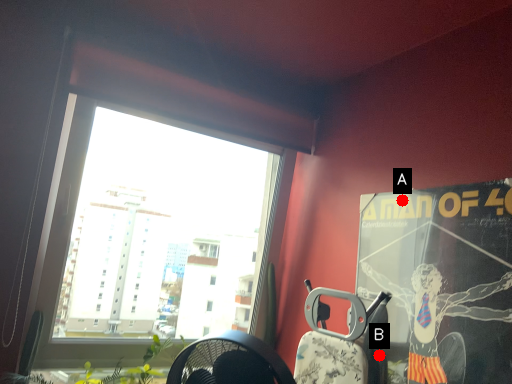
Question: Two points are circled on the image, labeled by A and B beside each circle. Which point is closer to the camera?

Choices:
 (A) A is closer
 (B) B is closer

Answer: (B)